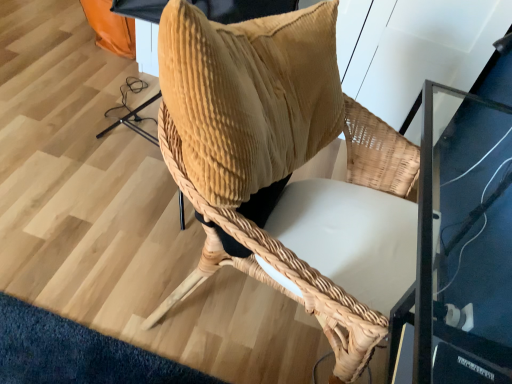
Question: Should I look upward or downward to see woven wood chair at center?

Choices:
 (A) down
 (B) up

Answer: (A)

Question: From the image's perspective, does corduroy pillow at center appear lower than woven wood chair at center?

Choices:
 (A) yes
 (B) no

Answer: (B)

Question: Is woven wood chair at center a part of corduroy pillow at center?

Choices:
 (A) no
 (B) yes

Answer: (A)

Question: Is corduroy pillow at center taller than woven wood chair at center?

Choices:
 (A) yes
 (B) no

Answer: (B)

Question: Is corduroy pillow at center completely or partially outside of woven wood chair at center?

Choices:
 (A) yes
 (B) no

Answer: (B)

Question: Is the position of corduroy pillow at center less distant than that of woven wood chair at center?

Choices:
 (A) no
 (B) yes

Answer: (B)

Question: Does corduroy pillow at center come behind woven wood chair at center?

Choices:
 (A) no
 (B) yes

Answer: (A)

Question: Considering the relative sizes of woven wood chair at center and corduroy pillow at center in the image provided, is woven wood chair at center taller than corduroy pillow at center?

Choices:
 (A) yes
 (B) no

Answer: (A)

Question: Is woven wood chair at center facing towards corduroy pillow at center?

Choices:
 (A) no
 (B) yes

Answer: (A)

Question: Is woven wood chair at center facing away from corduroy pillow at center?

Choices:
 (A) no
 (B) yes

Answer: (A)

Question: Considering the relative sizes of woven wood chair at center and corduroy pillow at center in the image provided, is woven wood chair at center smaller than corduroy pillow at center?

Choices:
 (A) yes
 (B) no

Answer: (B)

Question: Are woven wood chair at center and corduroy pillow at center beside each other?

Choices:
 (A) yes
 (B) no

Answer: (A)

Question: Can you confirm if woven wood chair at center is positioned to the right of corduroy pillow at center?

Choices:
 (A) no
 (B) yes

Answer: (B)

Question: In the image, is woven wood chair at center positioned in front of or behind corduroy pillow at center?

Choices:
 (A) front
 (B) behind

Answer: (B)